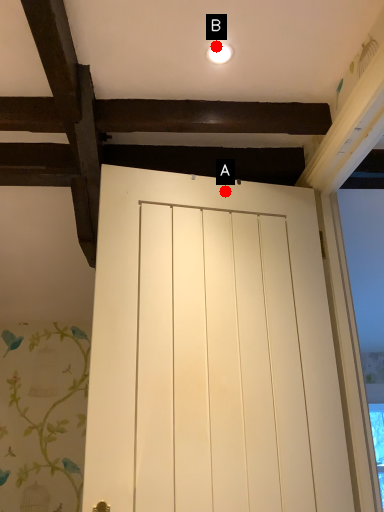
Question: Two points are circled on the image, labeled by A and B beside each circle. Which point appears closest to the camera in this image?

Choices:
 (A) A is closer
 (B) B is closer

Answer: (B)